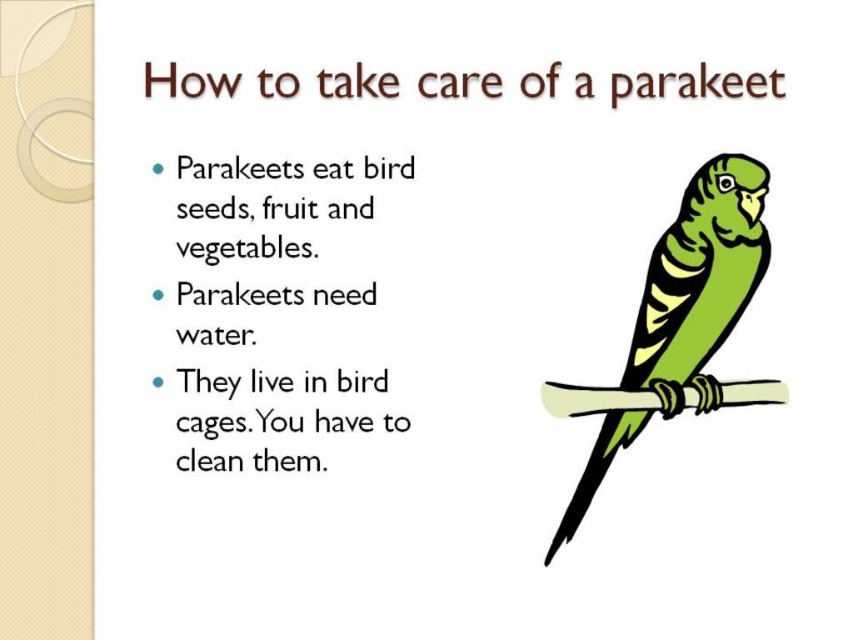
Based on the slide about parakeet care, which object, the green matte parrot at center or the white wood branch at center, is taller?

The green matte parrot at center is much taller than the white wood branch at center.

You are looking at a slide about parakeet care. You see a green matte parrot at center and a white wood branch at center. Which object is positioned higher in the slide?

The green matte parrot at center is positioned higher than the white wood branch at center.